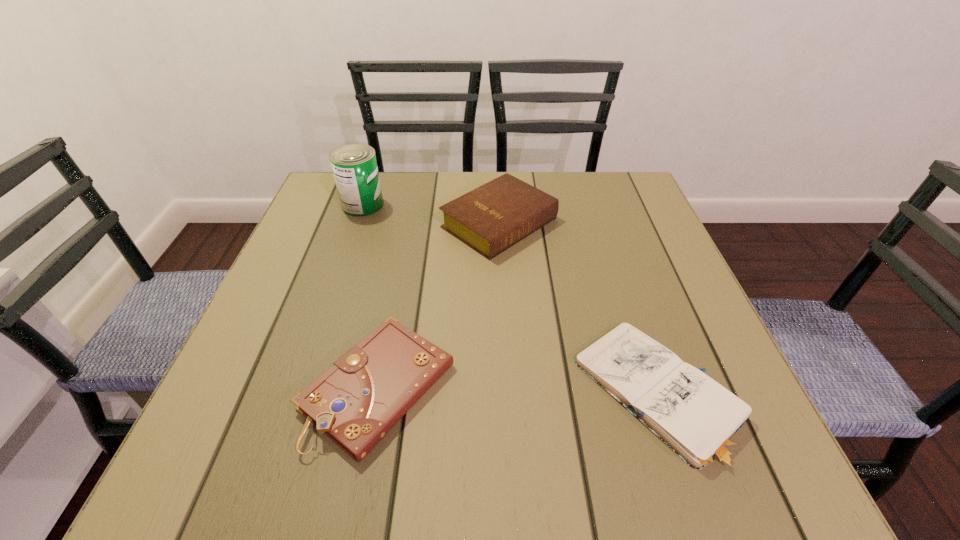
This screenshot has height=540, width=960. In order to click on vacant area that lies between the tallest object and the second shortest object in this screenshot , I will do `click(371, 295)`.

This screenshot has width=960, height=540. I want to click on vacant point located between the Bible and the tallest object, so click(x=431, y=214).

Identify the location of empty space that is in between the second shortest object and the right notebook. (517, 390).

Where is `blank region between the second tallest object and the taller notebook`? This screenshot has height=540, width=960. blank region between the second tallest object and the taller notebook is located at coordinates (439, 305).

In order to click on object that ranks as the third closest to the left notebook in this screenshot , I will do `click(354, 166)`.

At what (x,y) coordinates should I click in order to perform the action: click on object that can be found as the closest to the third shortest object. Please return your answer as a coordinate pair (x, y). Looking at the image, I should click on (354, 166).

At what (x,y) coordinates should I click in order to perform the action: click on vacant space that satisfies the following two spatial constraints: 1. on the front side of the tallest object; 2. on the left side of the shortest object. Please return your answer as a coordinate pair (x, y). This screenshot has height=540, width=960. Looking at the image, I should click on (298, 395).

Find the location of a particular element. free space in the image that satisfies the following two spatial constraints: 1. on the back side of the third shortest object; 2. on the left side of the left notebook is located at coordinates (410, 223).

This screenshot has height=540, width=960. I want to click on free location that satisfies the following two spatial constraints: 1. on the front side of the tallest object; 2. on the left side of the right notebook, so click(298, 395).

Image resolution: width=960 pixels, height=540 pixels. I want to click on vacant point that satisfies the following two spatial constraints: 1. on the front side of the tallest object; 2. on the left side of the shortest object, so click(298, 395).